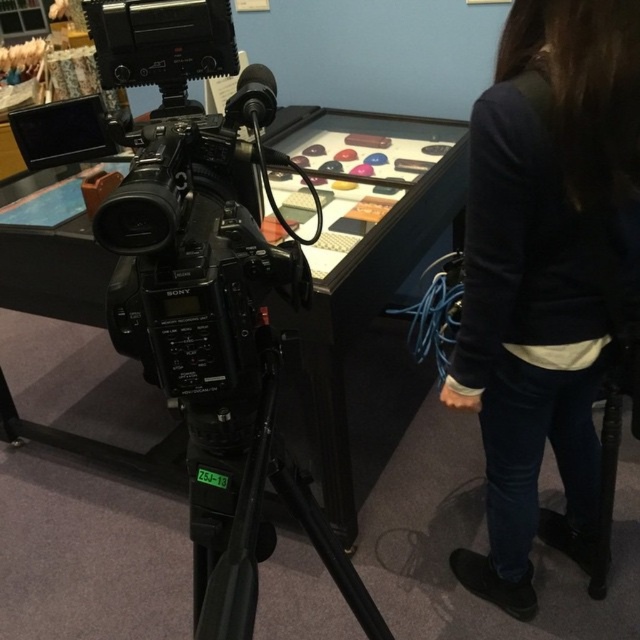
Based on the photo, is dark blue sweater at upper right above black matte tripod at center?

Yes.

Is dark blue sweater at upper right smaller than black matte tripod at center?

No.

This screenshot has width=640, height=640. Describe the element at coordinates (547, 273) in the screenshot. I see `dark blue sweater at upper right` at that location.

At what (x,y) coordinates should I click in order to perform the action: click on dark blue sweater at upper right. Please return your answer as a coordinate pair (x, y). Looking at the image, I should click on (547, 273).